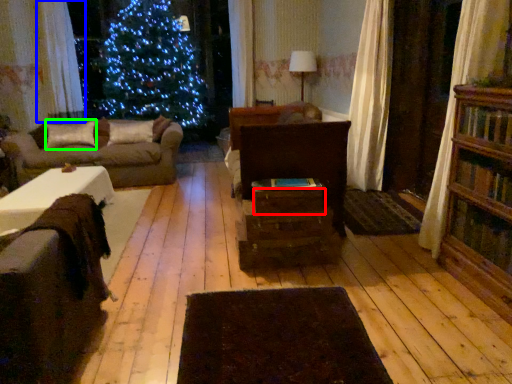
Question: Which object is positioned farthest from drawer (highlighted by a red box)? Select from curtain (highlighted by a blue box) and pillow (highlighted by a green box).

Choices:
 (A) curtain
 (B) pillow

Answer: (A)